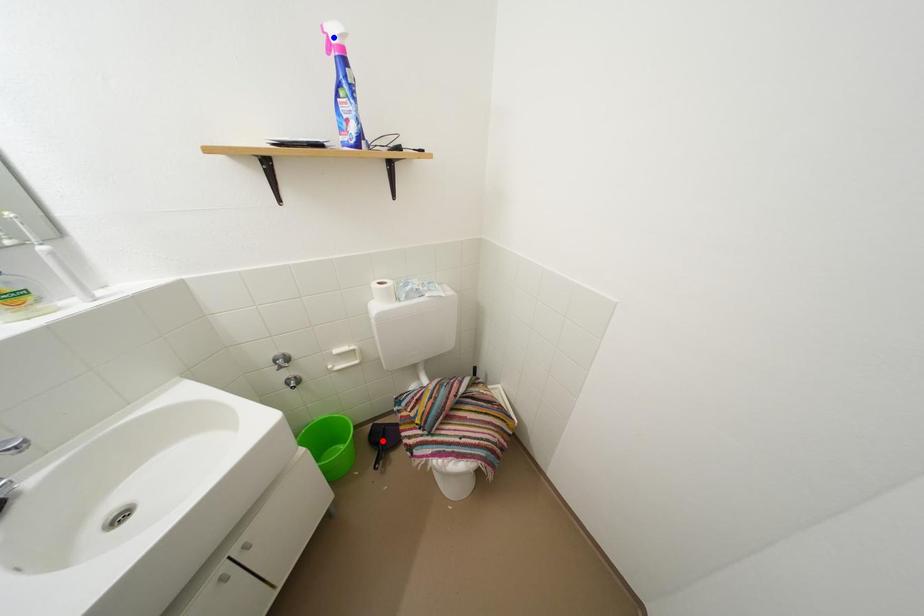
Question: Which of the two points in the image is closer to the camera?

Choices:
 (A) Blue point is closer.
 (B) Red point is closer.

Answer: (A)